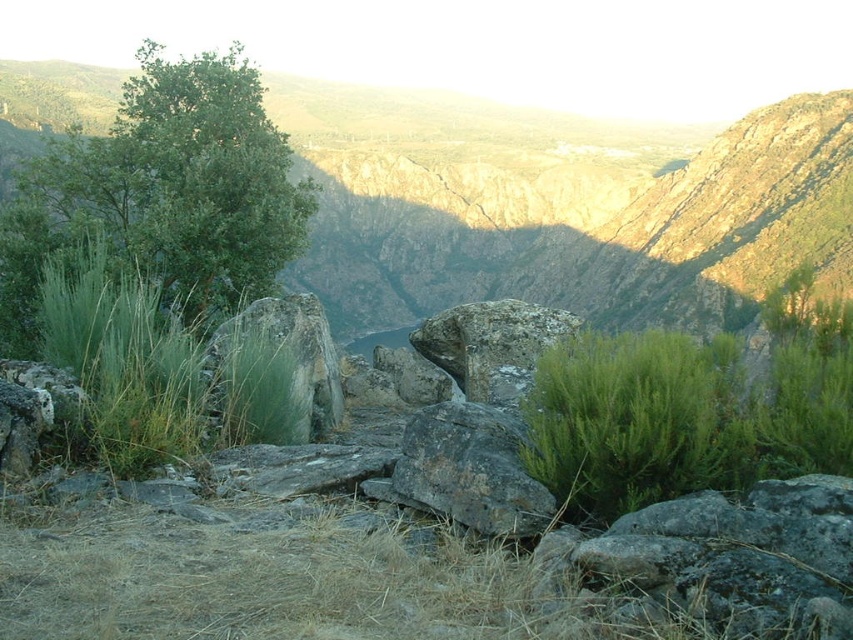
Question: Does rocky cliff at center have a greater width compared to green rough rock at left?

Choices:
 (A) yes
 (B) no

Answer: (A)

Question: From the image, what is the correct spatial relationship of green leafy tree at upper left in relation to green rough rock at left?

Choices:
 (A) above
 (B) below

Answer: (A)

Question: Which object is closer to the camera taking this photo?

Choices:
 (A) green leafy shrub at center right
 (B) green leafy tree at upper left
 (C) rough textured rock at center
 (D) rocky cliff at center

Answer: (A)

Question: Which point is farther to the camera?

Choices:
 (A) rusty rock at center
 (B) rocky cliff at center
 (C) green leafy tree at upper left
 (D) green leafy shrub at center right

Answer: (C)

Question: Does green leafy tree at upper left appear over rusty rock at center?

Choices:
 (A) yes
 (B) no

Answer: (A)

Question: Which is farther from the green leafy tree at upper left?

Choices:
 (A) rough textured rock at center
 (B) green rough rock at left
 (C) rocky cliff at center

Answer: (C)